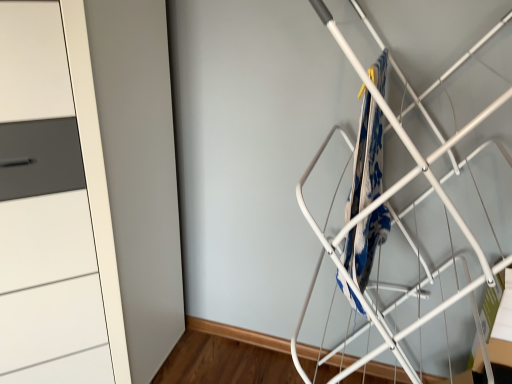
From the picture: What is the approximate height of white matte cabinet at left?

white matte cabinet at left is 4.42 feet tall.

Image resolution: width=512 pixels, height=384 pixels. Describe the element at coordinates (54, 206) in the screenshot. I see `white matte cabinet at left` at that location.

Identify the location of white matte cabinet at left. This screenshot has height=384, width=512. (54, 206).

Measure the distance between blue printed fabric at center-right and camera.

They are 29.25 inches apart.

This screenshot has height=384, width=512. Find the location of `blue printed fabric at center-right`. blue printed fabric at center-right is located at coordinates coord(366,157).

The image size is (512, 384). What do you see at coordinates (366, 157) in the screenshot?
I see `blue printed fabric at center-right` at bounding box center [366, 157].

In order to face blue printed fabric at center-right, should I rotate leftwards or rightwards?

To align with it, rotate right about 16.059°.

The image size is (512, 384). In order to click on white matte cabinet at left in this screenshot , I will do `click(54, 206)`.

Is white matte cabinet at left to the left of blue printed fabric at center-right from the viewer's perspective?

Correct, you'll find white matte cabinet at left to the left of blue printed fabric at center-right.

Considering the positions of objects white matte cabinet at left and blue printed fabric at center-right in the image provided, who is in front, white matte cabinet at left or blue printed fabric at center-right?

white matte cabinet at left.

Which is nearer, (3,358) or (380,78)?

The point (3,358) is more forward.

From the image's perspective, is white matte cabinet at left above or below blue printed fabric at center-right?

white matte cabinet at left is situated lower than blue printed fabric at center-right in the image.

From a real-world perspective, does white matte cabinet at left sit lower than blue printed fabric at center-right?

Yes.

Is white matte cabinet at left wider than blue printed fabric at center-right?

Correct, the width of white matte cabinet at left exceeds that of blue printed fabric at center-right.

Which of these two, white matte cabinet at left or blue printed fabric at center-right, stands taller?

With more height is white matte cabinet at left.

Looking at this image, looking at the image, does white matte cabinet at left seem bigger or smaller compared to blue printed fabric at center-right?

white matte cabinet at left is bigger than blue printed fabric at center-right.

Would you say white matte cabinet at left is outside blue printed fabric at center-right?

Absolutely, white matte cabinet at left is external to blue printed fabric at center-right.

Is white matte cabinet at left far from blue printed fabric at center-right?

No, there isn't a large distance between white matte cabinet at left and blue printed fabric at center-right.

Is white matte cabinet at left oriented towards blue printed fabric at center-right?

Yes, white matte cabinet at left is facing blue printed fabric at center-right.

How different are the orientations of white matte cabinet at left and blue printed fabric at center-right in degrees?

white matte cabinet at left and blue printed fabric at center-right are facing 88.1 degrees away from each other.

The image size is (512, 384). In order to click on cupboard in front of the blue printed fabric at center-right in this screenshot , I will do `click(54, 206)`.

Which object is positioned more to the left, blue printed fabric at center-right or white matte cabinet at left?

white matte cabinet at left is more to the left.

Is the position of blue printed fabric at center-right more distant than that of white matte cabinet at left?

Yes.

Considering the points (372, 81) and (41, 148), which point is behind, point (372, 81) or point (41, 148)?

The point (372, 81) is more distant.

From the image's perspective, between blue printed fabric at center-right and white matte cabinet at left, who is located below?

white matte cabinet at left.

From a real-world perspective, is blue printed fabric at center-right located beneath white matte cabinet at left?

Incorrect, from a real-world perspective, blue printed fabric at center-right is higher than white matte cabinet at left.

Which object is thinner, blue printed fabric at center-right or white matte cabinet at left?

blue printed fabric at center-right.

Does blue printed fabric at center-right have a greater height compared to white matte cabinet at left?

No, blue printed fabric at center-right is not taller than white matte cabinet at left.

Considering the relative sizes of blue printed fabric at center-right and white matte cabinet at left in the image provided, is blue printed fabric at center-right smaller than white matte cabinet at left?

Yes.

Is blue printed fabric at center-right outside of white matte cabinet at left?

Yes.

Looking at this image, is blue printed fabric at center-right directly adjacent to white matte cabinet at left?

They are not placed beside each other.

Is blue printed fabric at center-right oriented away from white matte cabinet at left?

blue printed fabric at center-right is not turned away from white matte cabinet at left.

Can you tell me how much blue printed fabric at center-right and white matte cabinet at left differ in facing direction?

There is a 88.1-degree angle between the facing directions of blue printed fabric at center-right and white matte cabinet at left.

In the image, there is a white matte cabinet at left. Where is `blanket above it (from the image's perspective)`? The image size is (512, 384). blanket above it (from the image's perspective) is located at coordinates (366, 157).

Locate an element on the screen. The image size is (512, 384). cupboard located below the blue printed fabric at center-right (from the image's perspective) is located at coordinates pyautogui.click(x=54, y=206).

I want to click on cupboard below the blue printed fabric at center-right (from a real-world perspective), so click(54, 206).